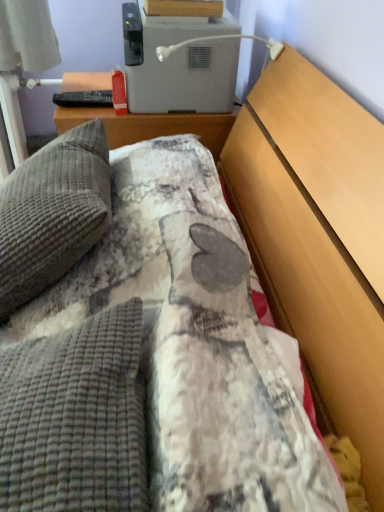
Question: Is gray textured pillow at left thinner than white plastic toaster at upper center?

Choices:
 (A) no
 (B) yes

Answer: (B)

Question: Is gray textured pillow at left placed right next to white plastic toaster at upper center?

Choices:
 (A) no
 (B) yes

Answer: (A)

Question: Is gray textured pillow at left looking in the opposite direction of white plastic toaster at upper center?

Choices:
 (A) no
 (B) yes

Answer: (A)

Question: From the image's perspective, does gray textured pillow at left appear lower than white plastic toaster at upper center?

Choices:
 (A) yes
 (B) no

Answer: (A)

Question: Is gray textured pillow at left not within white plastic toaster at upper center?

Choices:
 (A) yes
 (B) no

Answer: (A)

Question: Is gray textured pillow at left facing towards white plastic toaster at upper center?

Choices:
 (A) no
 (B) yes

Answer: (A)

Question: Considering the relative sizes of white plastic toaster at upper center and gray textured pillow at left in the image provided, is white plastic toaster at upper center taller than gray textured pillow at left?

Choices:
 (A) yes
 (B) no

Answer: (B)

Question: Does white plastic toaster at upper center have a smaller size compared to gray textured pillow at left?

Choices:
 (A) yes
 (B) no

Answer: (A)

Question: Does white plastic toaster at upper center have a larger size compared to gray textured pillow at left?

Choices:
 (A) yes
 (B) no

Answer: (B)

Question: Is the surface of white plastic toaster at upper center in direct contact with gray textured pillow at left?

Choices:
 (A) no
 (B) yes

Answer: (A)

Question: Is white plastic toaster at upper center far away from gray textured pillow at left?

Choices:
 (A) yes
 (B) no

Answer: (B)

Question: Is white plastic toaster at upper center not within gray textured pillow at left?

Choices:
 (A) yes
 (B) no

Answer: (A)

Question: Is white plastic toaster at upper center wider or thinner than gray textured pillow at left?

Choices:
 (A) thin
 (B) wide

Answer: (B)